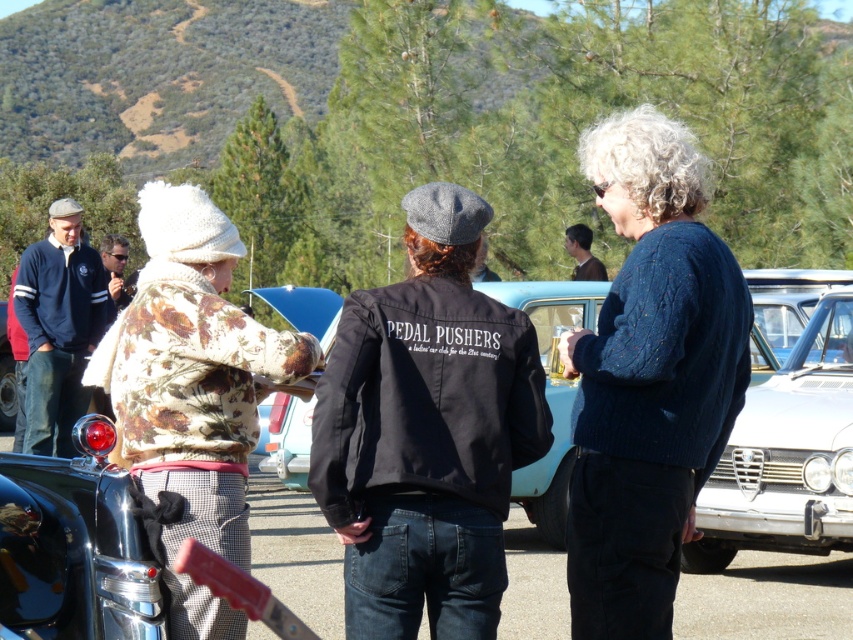
This screenshot has width=853, height=640. Describe the element at coordinates (426, 433) in the screenshot. I see `black fabric jacket at center` at that location.

Which is in front, point (415, 557) or point (113, 240)?

Point (415, 557) is in front.

Where is `black fabric jacket at center`? This screenshot has width=853, height=640. black fabric jacket at center is located at coordinates (426, 433).

At what (x,y) coordinates should I click in order to perform the action: click on black fabric jacket at center. Please return your answer as a coordinate pair (x, y). The width and height of the screenshot is (853, 640). Looking at the image, I should click on [426, 433].

Does black fabric jacket at center have a lesser width compared to dark blue jacket at left?

No.

Locate an element on the screen. The height and width of the screenshot is (640, 853). black fabric jacket at center is located at coordinates (426, 433).

Is black fabric car at center thinner than dark blue jacket at left?

Yes.

This screenshot has height=640, width=853. Identify the location of black fabric car at center. (550, 392).

Locate an element on the screen. This screenshot has height=640, width=853. black fabric car at center is located at coordinates (550, 392).

The image size is (853, 640). Find the location of `black fabric car at center`. black fabric car at center is located at coordinates (550, 392).